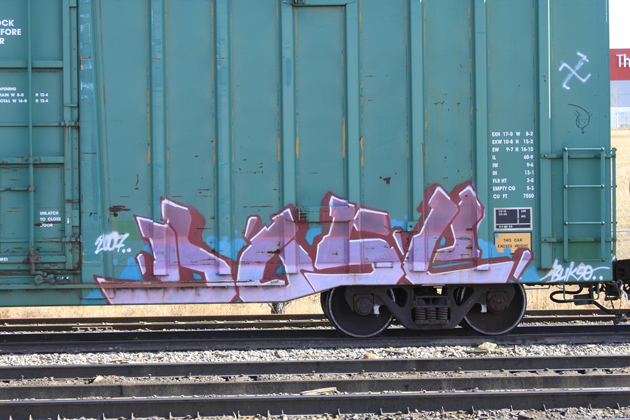
Locate an element on the screen. ladder is located at coordinates (567, 207).